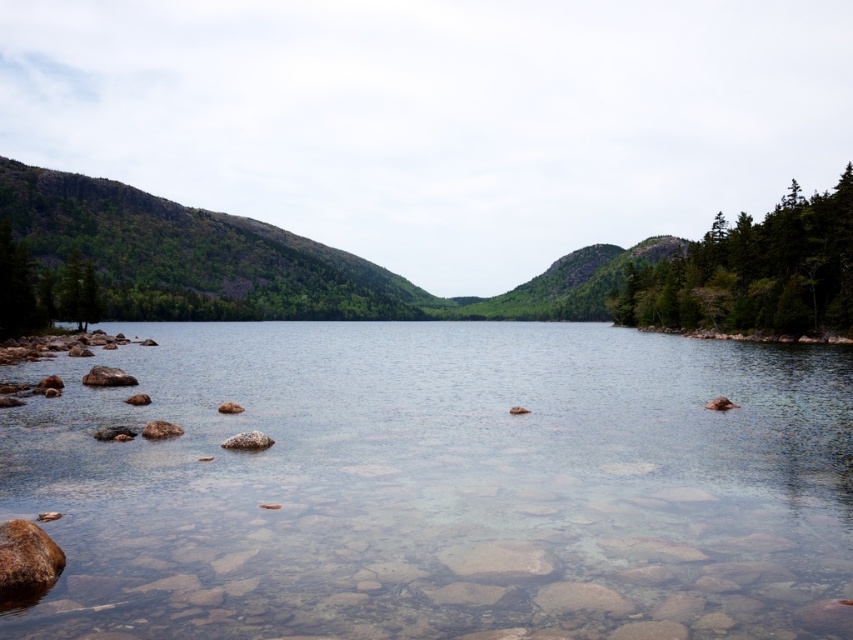
Between green rocky mountain at left and green matte tree at left, which one is positioned lower?

green matte tree at left is below.

Who is more forward, (140,253) or (74,294)?

Positioned in front is point (74,294).

Is point (78, 212) in front of point (96, 284)?

No, it is behind (96, 284).

Locate an element on the screen. green rocky mountain at left is located at coordinates (270, 260).

Can you confirm if green matte tree at right is thinner than brown rough rock at lower left?

In fact, green matte tree at right might be wider than brown rough rock at lower left.

Is green matte tree at right to the right of brown rough rock at lower left from the viewer's perspective?

Correct, you'll find green matte tree at right to the right of brown rough rock at lower left.

Identify the location of green matte tree at right. The image size is (853, 640). (755, 273).

Is clear stone water at center to the right of green rocky mountain at left from the viewer's perspective?

In fact, clear stone water at center is to the left of green rocky mountain at left.

Describe the element at coordinates (442, 484) in the screenshot. I see `clear stone water at center` at that location.

At what (x,y) coordinates should I click in order to perform the action: click on clear stone water at center. Please return your answer as a coordinate pair (x, y). The width and height of the screenshot is (853, 640). Looking at the image, I should click on (442, 484).